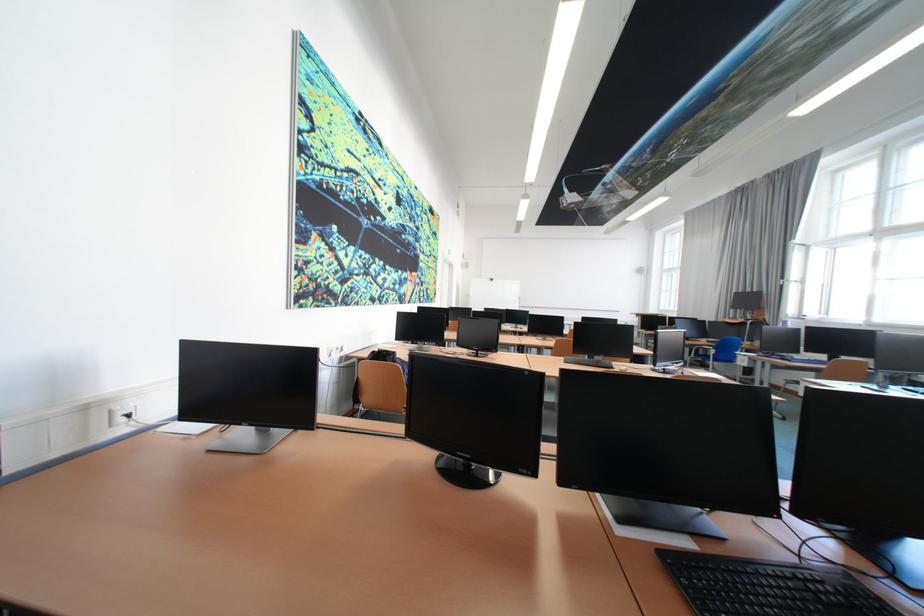
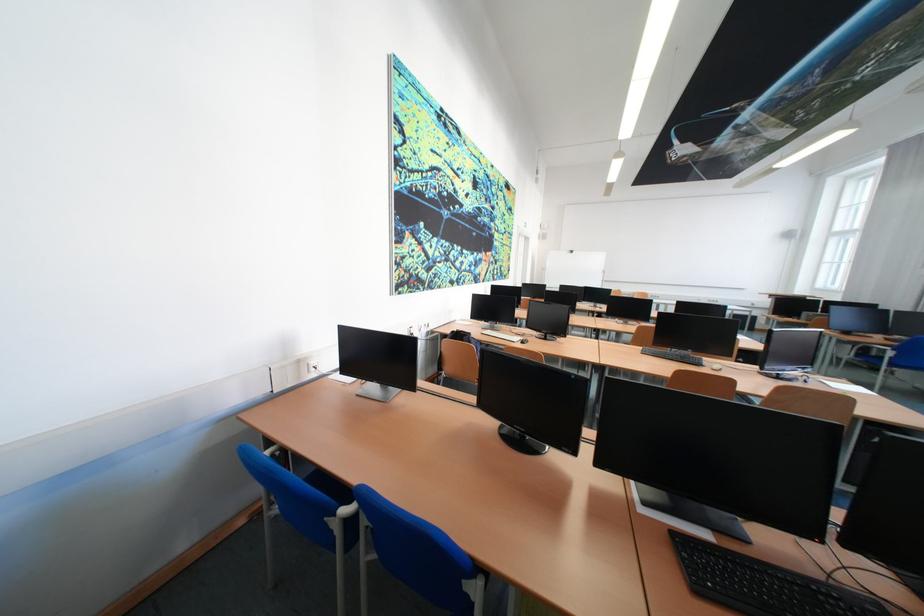
Question: The images are taken continuously from a first-person perspective. In which direction are you moving?

Choices:
 (A) Left
 (B) Right
 (C) Forward
 (D) Backward

Answer: (D)